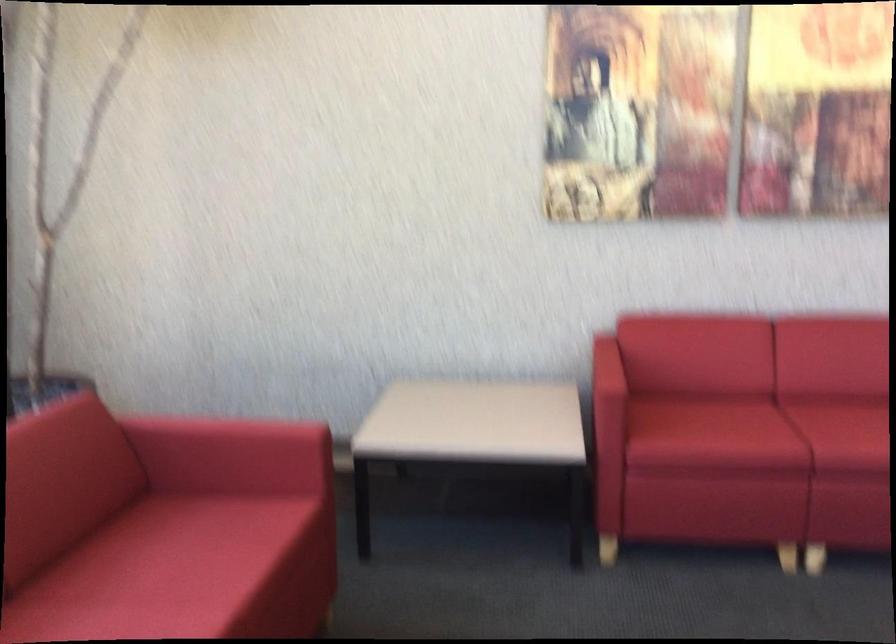
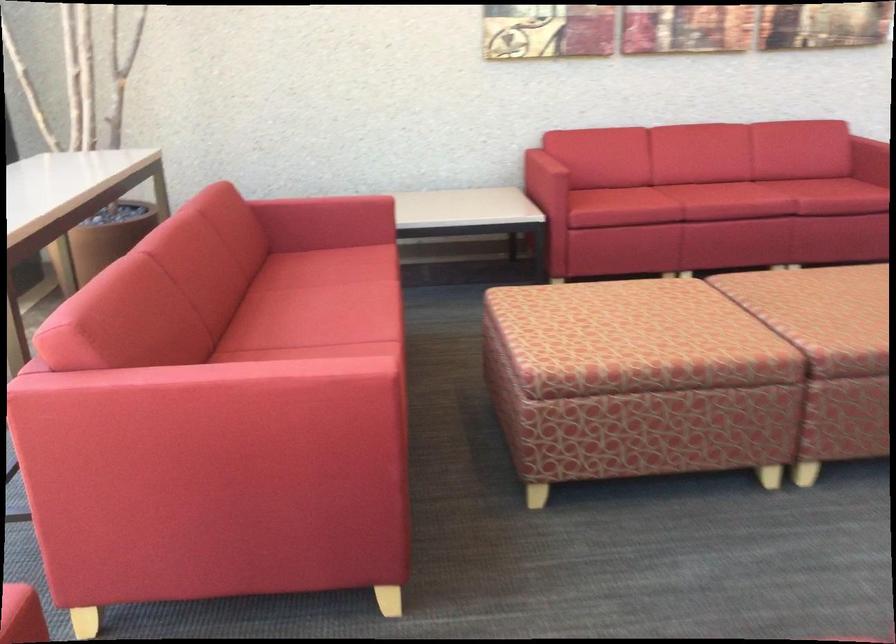
In the second image, find the point that corresponds to (600,381) in the first image.

(545, 166)